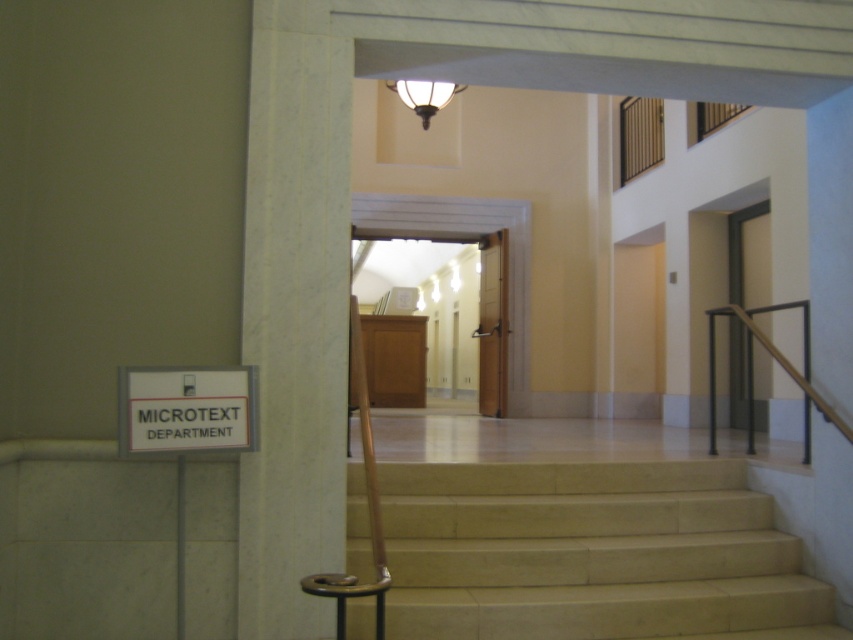
Which of these two, white marble pillar at left or white plastic sign at lower left, stands taller?

Standing taller between the two is white marble pillar at left.

Does white marble pillar at left appear on the right side of white plastic sign at lower left?

Correct, you'll find white marble pillar at left to the right of white plastic sign at lower left.

What do you see at coordinates (294, 308) in the screenshot? I see `white marble pillar at left` at bounding box center [294, 308].

This screenshot has height=640, width=853. I want to click on white marble pillar at left, so click(x=294, y=308).

Can you confirm if white marble pillar at left is positioned below black metal railing at right?

No.

Which is in front, point (280, 145) or point (756, 324)?

Positioned in front is point (280, 145).

Which is in front, point (283, 588) or point (836, 413)?

Point (283, 588)

You are a GUI agent. You are given a task and a screenshot of the screen. Output one action in this format:
    pyautogui.click(x=<x>, y=<y>)
    Task: Click on the white marble pillar at left
    The image size is (853, 640).
    Given the screenshot: What is the action you would take?
    pyautogui.click(x=294, y=308)

Can you confirm if beige marble stairs at center is positioned to the left of black metal railing at right?

Indeed, beige marble stairs at center is positioned on the left side of black metal railing at right.

Does point (695, 584) come closer to viewer compared to point (708, 348)?

Yes, point (695, 584) is closer to viewer.

Locate an element on the screen. The image size is (853, 640). beige marble stairs at center is located at coordinates (593, 554).